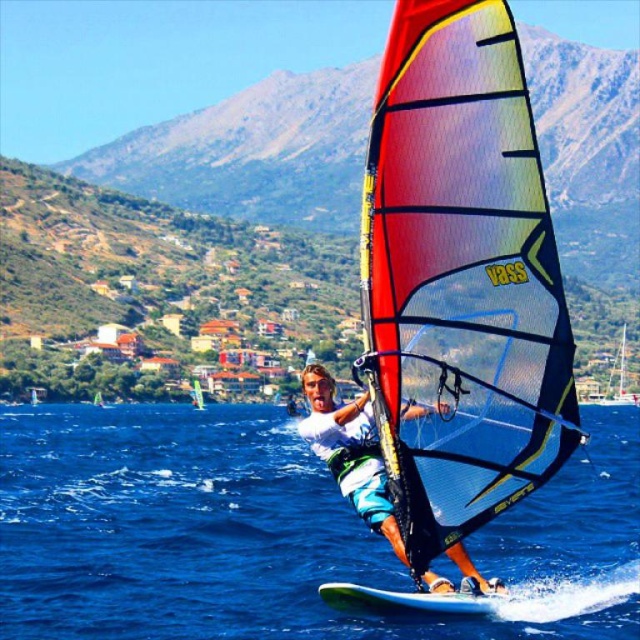
You are a photographer trying to capture the entire windsurfer and their sail in a single shot. Given the blue water at center and the multicolored mesh sail at center, which object is wider so that you can adjust your camera angle accordingly?

The blue water at center is wider than the multicolored mesh sail at center, so you should adjust your camera angle to accommodate the wider blue water at center.

You are a photographer trying to capture the windsurfer and the board in a single shot. The minimum distance your camera can focus on two objects is 60 meters. Can you fit both the windsurfer and the matte white windsurfing board at center in your shot?

The distance between the windsurfer and the matte white windsurfing board at center is 62.69 meters, which exceeds the camera focus limit of 60 meters. Therefore, you cannot capture both in a single focused shot.

From the picture: You are a photographer trying to capture the windsurfer in the image. You want to ensure the blue water at center and the green mesh sail at center are both in focus. Which object should you adjust your camera focus on first to account for their sizes?

The blue water at center is wider than the green mesh sail at center, so you should focus on the blue water at center first to ensure its larger area is sharp.